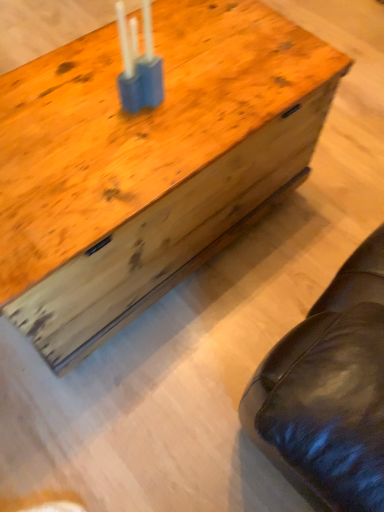
Find the location of `vacant space to the left of blue plastic candle holder at center`. vacant space to the left of blue plastic candle holder at center is located at coordinates (62, 102).